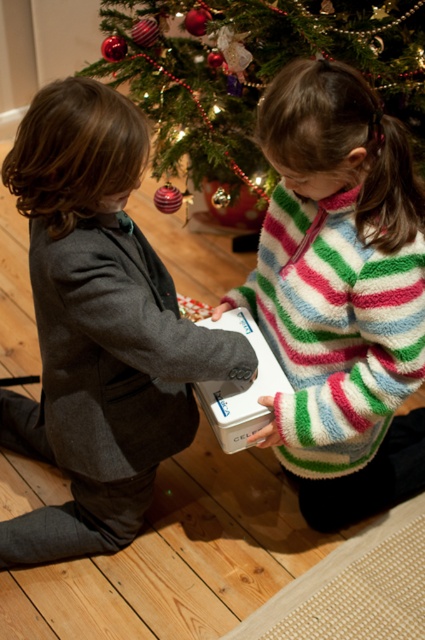
You are a photographer trying to capture a photo of the dark gray suit at left and the green textured christmas tree at upper center. Which object should you focus on first if you want to ensure both are in focus without adjusting the camera settings?

The dark gray suit at left is taller than the green textured christmas tree at upper center, so focusing on the dark gray suit at left first would help ensure both are in focus since it is larger and closer to the camera.

You are a photographer standing near the camera. You want to take a picture of the boy in the dark gray suit at left without moving the camera. Can you do it?

The dark gray suit at left and camera are 1.08 meters apart from each other, so yes, the photographer can take a picture of the boy in the dark gray suit at left without moving the camera since the distance is sufficient for a clear shot.

You are a photographer trying to capture a photo of the children and their presents. You want to ensure both the dark gray suit at left and the white fluffy sweater at center are clearly visible in the frame. Based on their positions, which child should you focus on first to ensure both are in focus?

The dark gray suit at left is positioned on the left side of white fluffy sweater at center. To ensure both are in focus, you should focus on the child wearing the white fluffy sweater at center first, as it is closer to the center of the frame and the dark gray suit at left is to its left, allowing the depth of field to cover both.